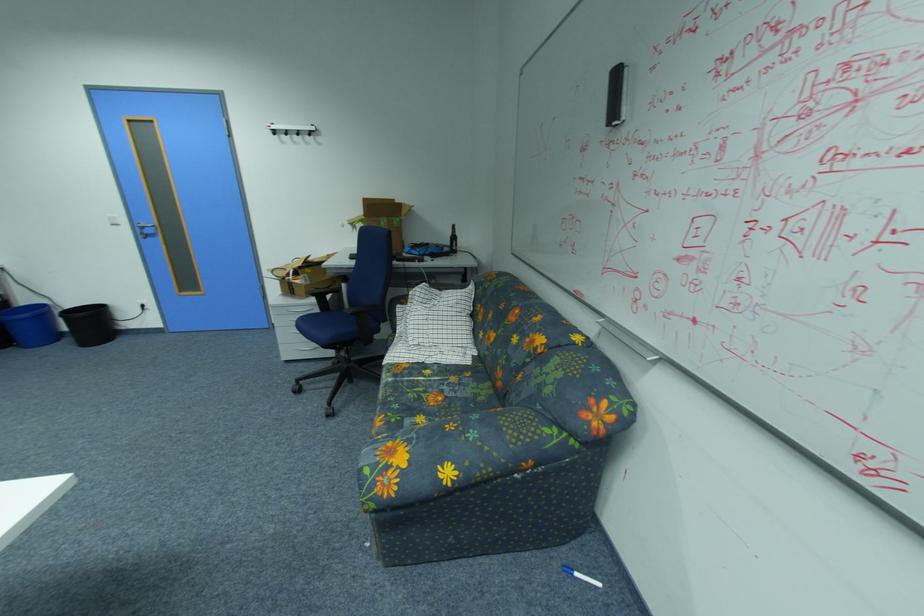
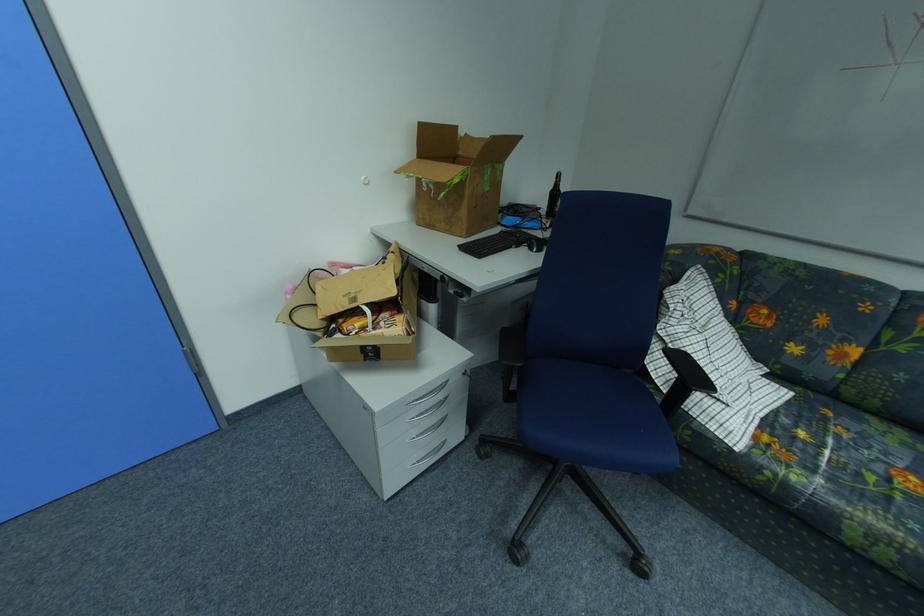
In the second image, find the point that corresponds to pixel 459 235 in the first image.

(560, 188)